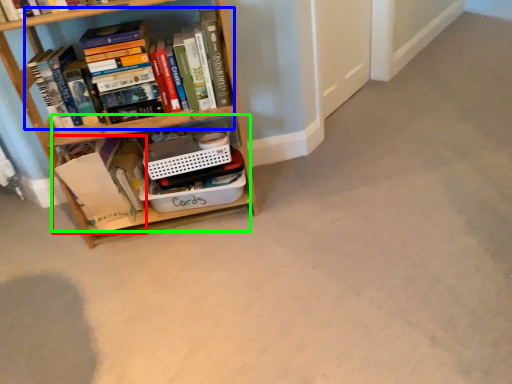
Question: Which is farther away from book (highlighted by a red box)? book (highlighted by a blue box) or cabinet (highlighted by a green box)?

Choices:
 (A) book
 (B) cabinet

Answer: (A)